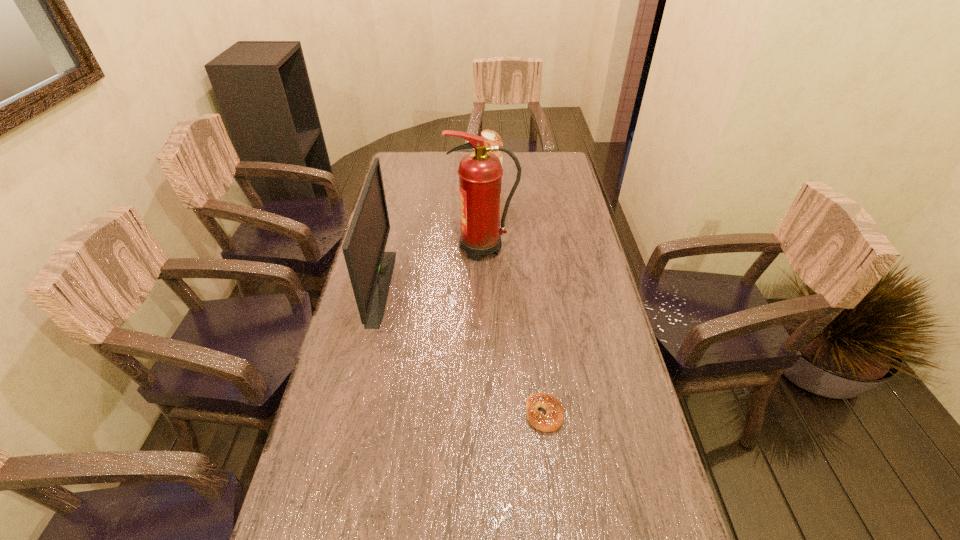
Where is `free space that satisfies the following two spatial constraints: 1. on the front-facing side of the tallest object; 2. on the left side of the shortest object`? free space that satisfies the following two spatial constraints: 1. on the front-facing side of the tallest object; 2. on the left side of the shortest object is located at coordinates (484, 414).

This screenshot has width=960, height=540. I want to click on free space that satisfies the following two spatial constraints: 1. on the back side of the bagel; 2. on the front-facing side of the fire extinguisher, so click(525, 248).

Locate an element on the screen. free spot that satisfies the following two spatial constraints: 1. on the front-facing side of the fire extinguisher; 2. on the back side of the bagel is located at coordinates (484, 414).

The image size is (960, 540). In order to click on vacant area in the image that satisfies the following two spatial constraints: 1. on the back side of the bagel; 2. on the front-facing side of the second tallest object in this screenshot , I will do `click(530, 287)`.

Image resolution: width=960 pixels, height=540 pixels. I want to click on free space in the image that satisfies the following two spatial constraints: 1. on the front-facing side of the second tallest object; 2. on the left side of the nearest object, so tap(351, 414).

Find the location of `vacant space that satisfies the following two spatial constraints: 1. on the front-facing side of the fire extinguisher; 2. on the back side of the shortest object`. vacant space that satisfies the following two spatial constraints: 1. on the front-facing side of the fire extinguisher; 2. on the back side of the shortest object is located at coordinates (484, 414).

At what (x,y) coordinates should I click in order to perform the action: click on vacant region that satisfies the following two spatial constraints: 1. on the front-facing side of the monitor; 2. on the right side of the shortest object. Please return your answer as a coordinate pair (x, y). The width and height of the screenshot is (960, 540). Looking at the image, I should click on (351, 414).

Identify the location of free space that satisfies the following two spatial constraints: 1. on the back side of the bagel; 2. on the front-facing side of the third shortest object. (530, 287).